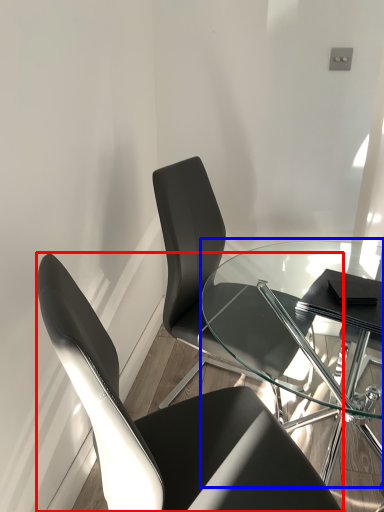
Question: Which object is closer to the camera taking this photo, chair (highlighted by a red box) or table (highlighted by a blue box)?

Choices:
 (A) chair
 (B) table

Answer: (A)